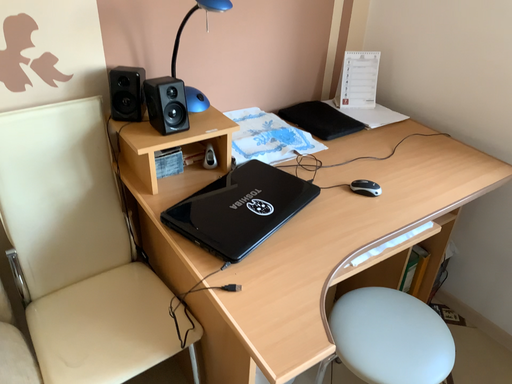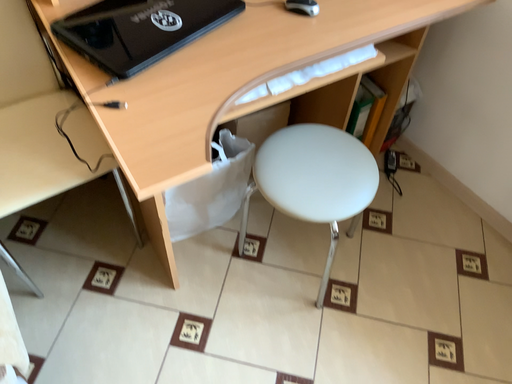
Question: Which way did the camera rotate in the video?

Choices:
 (A) rotated downward
 (B) rotated upward

Answer: (A)